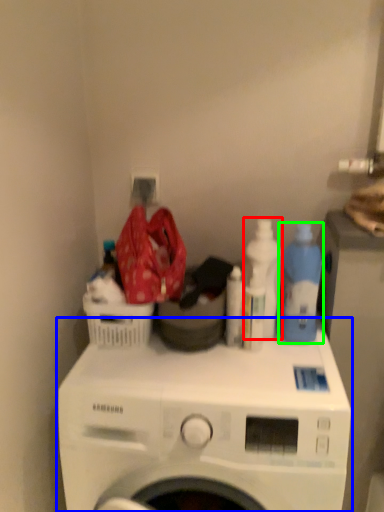
Question: Which is farther away from cleaning product (highlighted by a red box)? washing machine (highlighted by a blue box) or cleaning product (highlighted by a green box)?

Choices:
 (A) washing machine
 (B) cleaning product

Answer: (A)